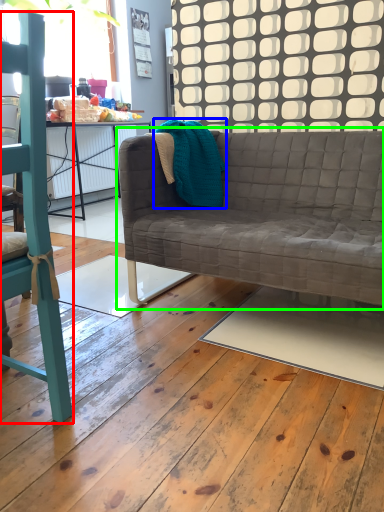
Question: Estimate the real-world distances between objects in this image. Which object is closer to chair (highlighted by a red box), material (highlighted by a blue box) or studio couch (highlighted by a green box)?

Choices:
 (A) material
 (B) studio couch

Answer: (B)